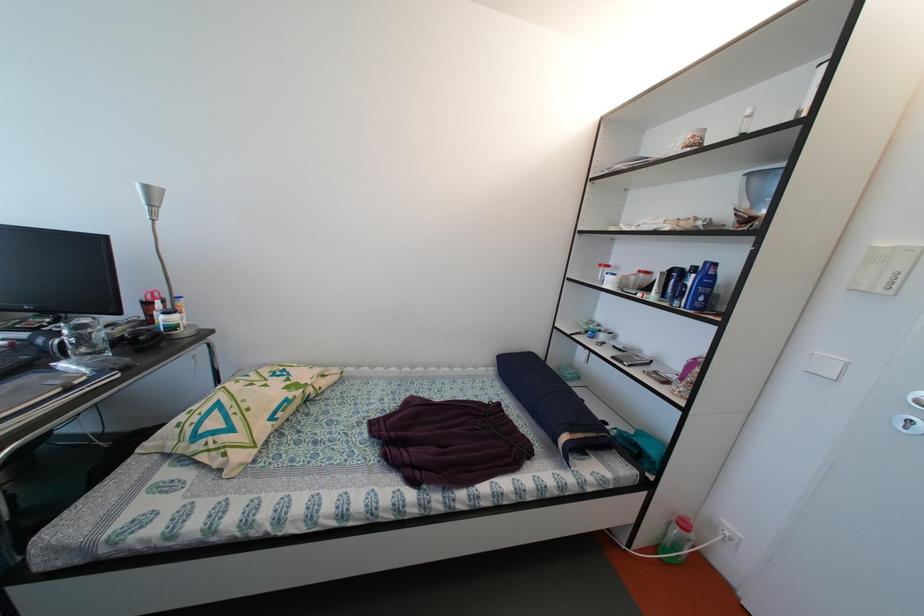
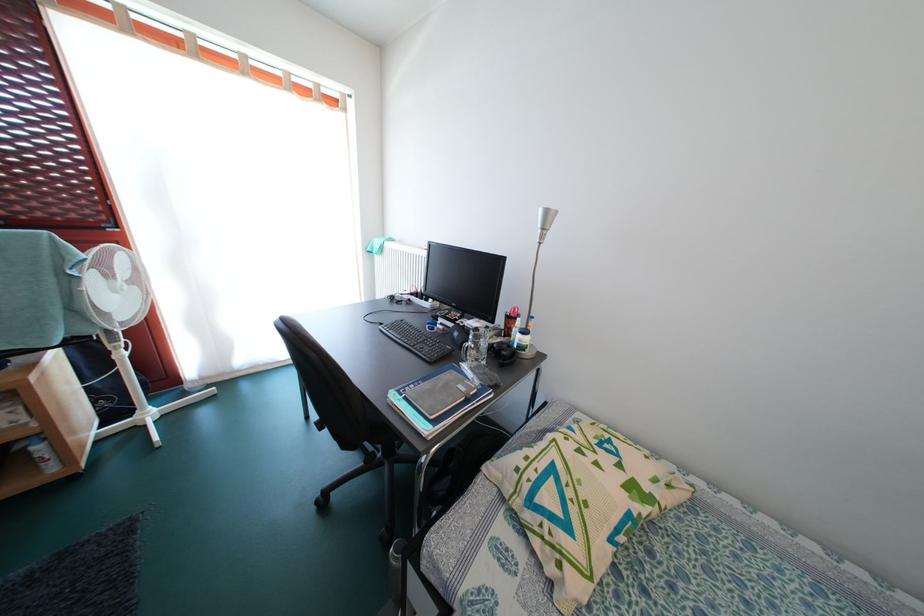
Question: How did the camera likely rotate?

Choices:
 (A) Left
 (B) Right
 (C) Up
 (D) Down

Answer: (A)